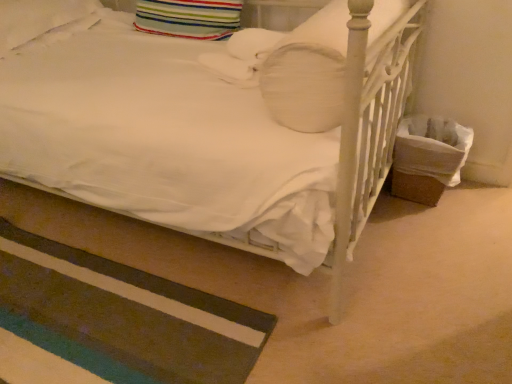
Question: Can you confirm if white soft pillow at upper left, which is counted as the 3th pillow, starting from the right, is bigger than striped carpet at lower left?

Choices:
 (A) no
 (B) yes

Answer: (B)

Question: Is white soft pillow at upper left, which ranks as the first pillow in left-to-right order, at the left side of striped carpet at lower left?

Choices:
 (A) yes
 (B) no

Answer: (A)

Question: Is white soft pillow at upper left, which ranks as the first pillow in left-to-right order, further to camera compared to striped carpet at lower left?

Choices:
 (A) no
 (B) yes

Answer: (B)

Question: From the image's perspective, is white soft pillow at upper left, which ranks as the first pillow in left-to-right order, on striped carpet at lower left?

Choices:
 (A) no
 (B) yes

Answer: (B)

Question: Is striped carpet at lower left a part of white soft pillow at upper left, which is counted as the 3th pillow, starting from the right?

Choices:
 (A) yes
 (B) no

Answer: (B)

Question: Relative to white soft pillow at upper left, which ranks as the first pillow in left-to-right order, is white matte pillow at upper center, marked as the third pillow in a left-to-right arrangement, in front or behind?

Choices:
 (A) front
 (B) behind

Answer: (A)

Question: From the image's perspective, is white matte pillow at upper center, placed as the 1th pillow when sorted from right to left, located above or below white soft pillow at upper left, which ranks as the first pillow in left-to-right order?

Choices:
 (A) below
 (B) above

Answer: (A)

Question: Considering the positions of white matte pillow at upper center, marked as the third pillow in a left-to-right arrangement, and white soft pillow at upper left, which is counted as the 3th pillow, starting from the right, in the image, is white matte pillow at upper center, marked as the third pillow in a left-to-right arrangement, wider or thinner than white soft pillow at upper left, which is counted as the 3th pillow, starting from the right,?

Choices:
 (A) wide
 (B) thin

Answer: (A)

Question: Is point (317, 41) closer or farther from the camera than point (37, 9)?

Choices:
 (A) farther
 (B) closer

Answer: (B)

Question: Is white matte pillow at upper center, marked as the third pillow in a left-to-right arrangement, to the left or to the right of striped carpet at lower left in the image?

Choices:
 (A) right
 (B) left

Answer: (A)

Question: Is white matte pillow at upper center, placed as the 1th pillow when sorted from right to left, taller or shorter than striped carpet at lower left?

Choices:
 (A) short
 (B) tall

Answer: (B)

Question: From the image's perspective, relative to striped carpet at lower left, is white matte pillow at upper center, placed as the 1th pillow when sorted from right to left, above or below?

Choices:
 (A) above
 (B) below

Answer: (A)

Question: From a real-world perspective, is white matte pillow at upper center, placed as the 1th pillow when sorted from right to left, physically located above or below striped carpet at lower left?

Choices:
 (A) above
 (B) below

Answer: (A)

Question: Is point (234, 3) positioned closer to the camera than point (137, 354)?

Choices:
 (A) closer
 (B) farther

Answer: (B)

Question: Based on their positions, is striped fabric pillow at upper center, placed as the second pillow when sorted from left to right, located to the left or right of striped carpet at lower left?

Choices:
 (A) left
 (B) right

Answer: (B)